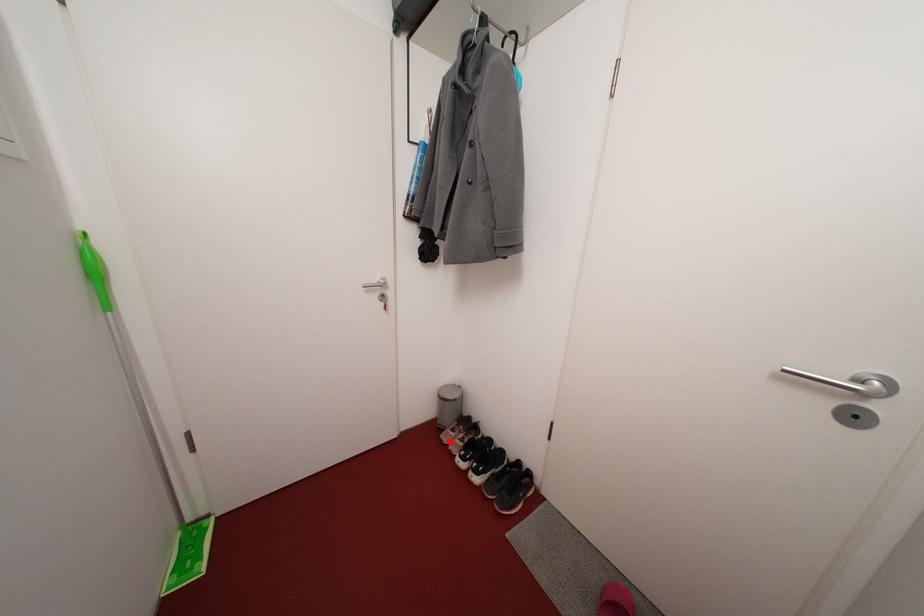
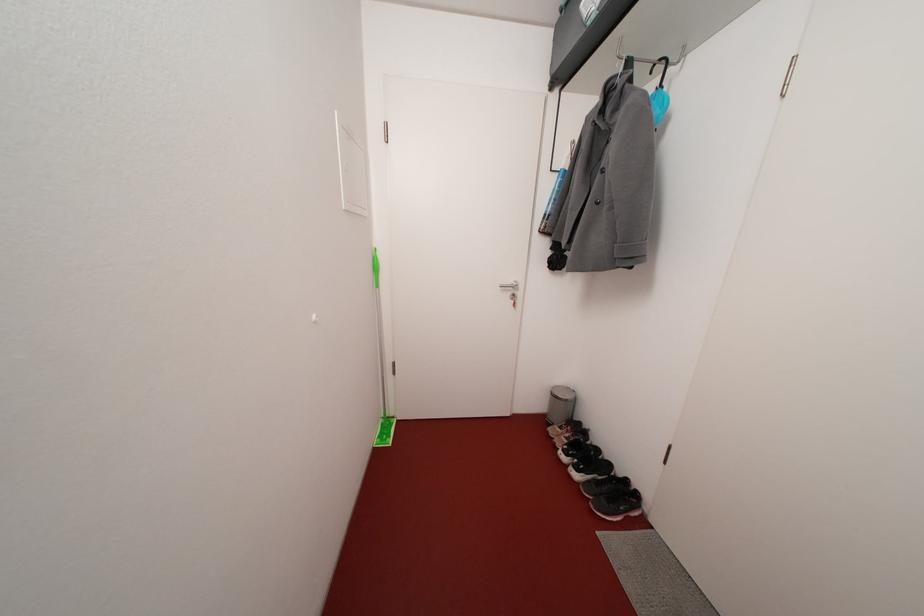
Find the pixel in the second image that matches the highlighted location in the first image.

(556, 435)